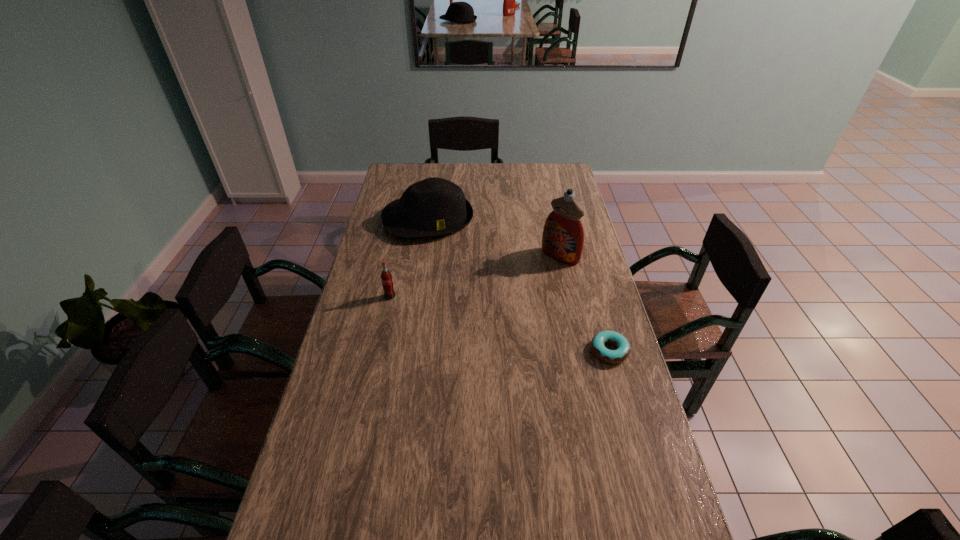
The width and height of the screenshot is (960, 540). Identify the location of free space at the right edge of the desktop. (607, 322).

Find the location of a particular element. The height and width of the screenshot is (540, 960). vacant area at the far left corner of the desktop is located at coordinates (419, 174).

Locate an element on the screen. free spot between the fedora and the soda bottle is located at coordinates (409, 258).

Find the location of a particular element. This screenshot has height=540, width=960. vacant area that lies between the tallest object and the soda bottle is located at coordinates (475, 276).

At what (x,y) coordinates should I click in order to perform the action: click on free spot between the third farthest object and the nearest object. Please return your answer as a coordinate pair (x, y). The height and width of the screenshot is (540, 960). Looking at the image, I should click on pos(500,323).

Find the location of a particular element. The height and width of the screenshot is (540, 960). vacant area that lies between the second farthest object and the farthest object is located at coordinates (494, 238).

Identify the location of vacant point located between the doughnut and the soda bottle. This screenshot has width=960, height=540. (500, 323).

Find the location of a particular element. free area in between the third farthest object and the tallest object is located at coordinates (475, 276).

Locate an element on the screen. free space between the shortest object and the third farthest object is located at coordinates (x=500, y=323).

Find the location of a particular element. Image resolution: width=960 pixels, height=540 pixels. vacant area that lies between the doughnut and the soda bottle is located at coordinates (500, 323).